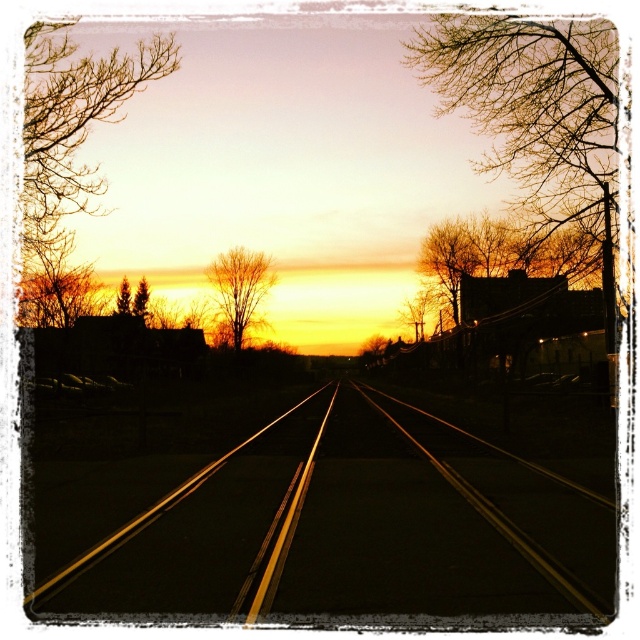
You are standing at the center of the railway tracks and see two green matte trees. One is labeled as green matte tree at upper left, and the other is green matte tree at left. From your position, which tree is positioned to the right side?

The green matte tree at upper left is to the right of the green matte tree at left, so the green matte tree at upper left is positioned to the right side from your position.